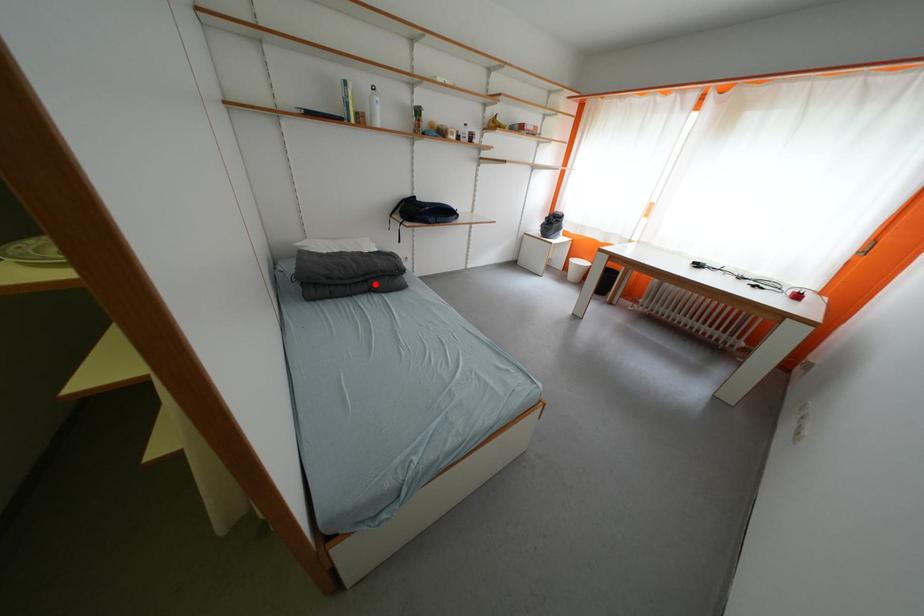
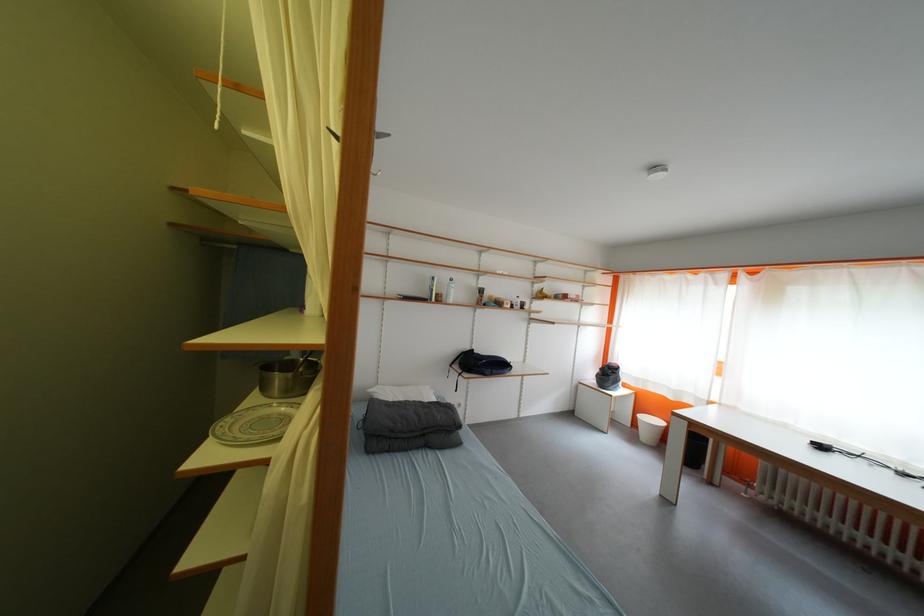
Question: A red point is marked in image1. In image2, is the corresponding 3D point closer to the camera or farther? Reply with the corresponding letter.

Choices:
 (A) The corresponding 3D point is closer.
 (B) The corresponding 3D point is farther.

Answer: (B)